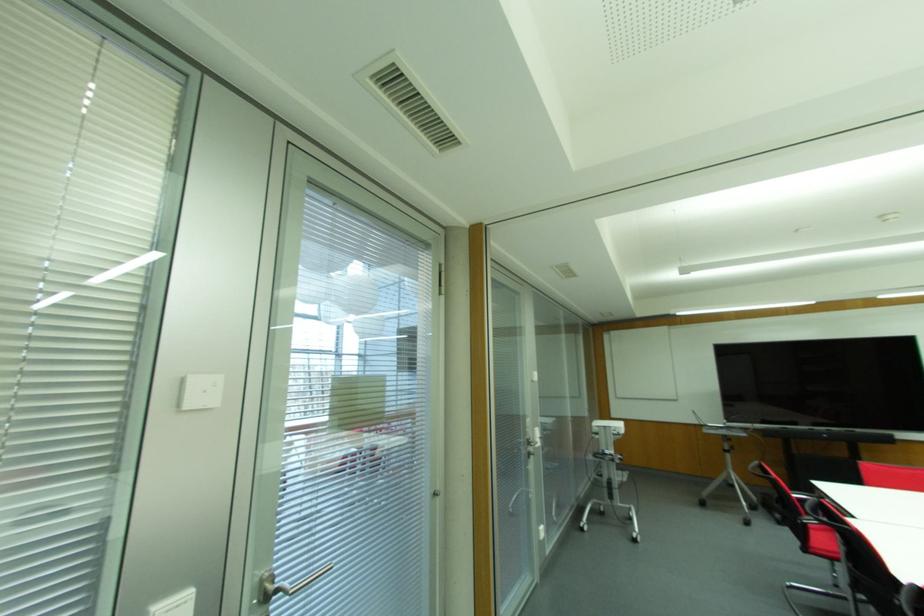
Where would you pull the silver door handle? Please return your answer as a coordinate pair (x, y).

(312, 580)